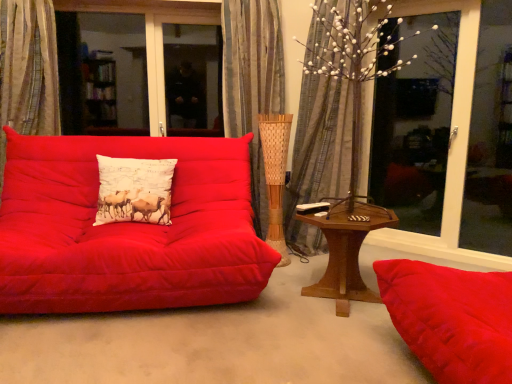
Question: Is silky gray curtain at center, the 3th curtain in the left-to-right sequence, to the right of white printed cushion at center from the viewer's perspective?

Choices:
 (A) yes
 (B) no

Answer: (A)

Question: From the image's perspective, is silky gray curtain at center, the 3th curtain in the left-to-right sequence, beneath white printed cushion at center?

Choices:
 (A) no
 (B) yes

Answer: (A)

Question: Is silky gray curtain at center, the 3th curtain in the left-to-right sequence, positioned far away from white printed cushion at center?

Choices:
 (A) no
 (B) yes

Answer: (B)

Question: Can you confirm if silky gray curtain at center, the 3th curtain in the left-to-right sequence, is taller than white printed cushion at center?

Choices:
 (A) yes
 (B) no

Answer: (A)

Question: From the image's perspective, is silky gray curtain at center, the 3th curtain in the left-to-right sequence, over white printed cushion at center?

Choices:
 (A) no
 (B) yes

Answer: (B)

Question: In terms of height, does silky gray curtain at center, the 3th curtain in the left-to-right sequence, look taller or shorter compared to white printed cushion at center?

Choices:
 (A) tall
 (B) short

Answer: (A)

Question: Is point (334, 140) positioned closer to the camera than point (154, 173)?

Choices:
 (A) closer
 (B) farther

Answer: (B)

Question: From a real-world perspective, relative to white printed cushion at center, is silky gray curtain at center, the 3th curtain in the left-to-right sequence, vertically above or below?

Choices:
 (A) below
 (B) above

Answer: (B)

Question: Choose the correct answer: Is silky gray curtain at center, which is counted as the 1th curtain, starting from the right, inside white printed cushion at center or outside it?

Choices:
 (A) inside
 (B) outside

Answer: (B)

Question: Looking at the image, does wooden hexagonal table at center seem bigger or smaller compared to white printed cushion at center?

Choices:
 (A) big
 (B) small

Answer: (A)

Question: Relative to white printed cushion at center, is wooden hexagonal table at center in front or behind?

Choices:
 (A) front
 (B) behind

Answer: (A)

Question: From a real-world perspective, is wooden hexagonal table at center above or below white printed cushion at center?

Choices:
 (A) above
 (B) below

Answer: (B)

Question: Looking at their shapes, would you say wooden hexagonal table at center is wider or thinner than white printed cushion at center?

Choices:
 (A) thin
 (B) wide

Answer: (B)

Question: In the image, is wooden hexagonal table at center positioned in front of or behind silky gray curtain at center, which is counted as the 1th curtain, starting from the right?

Choices:
 (A) front
 (B) behind

Answer: (A)

Question: From a real-world perspective, is wooden hexagonal table at center physically located above or below silky gray curtain at center, the 3th curtain in the left-to-right sequence?

Choices:
 (A) below
 (B) above

Answer: (A)